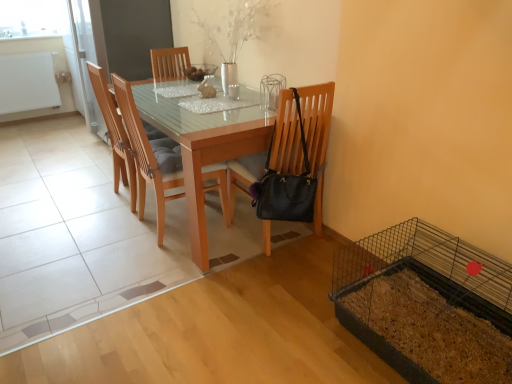
Measure the distance between black leather chair at center, acting as the 3th chair starting from the left, and camera.

The depth of black leather chair at center, acting as the 3th chair starting from the left, is 6.85 feet.

The image size is (512, 384). Identify the location of black leather chair at center, the first chair viewed from the right. (317, 136).

What is the approximate height of white matte radiator at upper left?

The height of white matte radiator at upper left is 24.44 inches.

The image size is (512, 384). In order to click on wooden chair at center, acting as the second chair starting from the right in this screenshot , I will do `click(146, 157)`.

Find the location of a particular element. light brown wood table at center is located at coordinates (204, 148).

At what (x,y) coordinates should I click in order to perform the action: click on radiator on the left of wooden chair at center, which is counted as the 3th chair, starting from the right. Please return your answer as a coordinate pair (x, y). Looking at the image, I should click on (27, 82).

From the image's perspective, is wooden chair at center, which is counted as the 3th chair, starting from the right, on white matte radiator at upper left?

No, from the image's perspective, wooden chair at center, which is counted as the 3th chair, starting from the right, is not above white matte radiator at upper left.

How many degrees apart are the facing directions of wooden chair at center, which is counted as the 3th chair, starting from the right, and white matte radiator at upper left?

90 degrees.

Does wooden chair at center, marked as the 1th chair in a left-to-right arrangement, have a greater width compared to white matte radiator at upper left?

Yes, wooden chair at center, marked as the 1th chair in a left-to-right arrangement, is wider than white matte radiator at upper left.

From the image's perspective, does light brown wood table at center appear higher than black leather chair at center, the first chair viewed from the right?

Yes, from the image's perspective, light brown wood table at center is above black leather chair at center, the first chair viewed from the right.

Does point (267, 240) come closer to viewer compared to point (307, 104)?

No, (267, 240) is further to viewer.

Would you say light brown wood table at center is inside or outside black leather chair at center, acting as the 3th chair starting from the left?

The correct answer is: outside.

Considering the sizes of objects light brown wood table at center and black leather chair at center, acting as the 3th chair starting from the left, in the image provided, who is smaller, light brown wood table at center or black leather chair at center, acting as the 3th chair starting from the left,?

Smaller between the two is black leather chair at center, acting as the 3th chair starting from the left.

In the scene shown: Is black leather chair at center, the first chair viewed from the right, in contact with white matte radiator at upper left?

black leather chair at center, the first chair viewed from the right, and white matte radiator at upper left are clearly separated.

Considering the relative sizes of black leather chair at center, acting as the 3th chair starting from the left, and white matte radiator at upper left in the image provided, is black leather chair at center, acting as the 3th chair starting from the left, shorter than white matte radiator at upper left?

No, black leather chair at center, acting as the 3th chair starting from the left, is not shorter than white matte radiator at upper left.

Where is `radiator on the left side of black leather chair at center, the first chair viewed from the right`? This screenshot has height=384, width=512. radiator on the left side of black leather chair at center, the first chair viewed from the right is located at coordinates (27, 82).

Is the position of black leather chair at center, acting as the 3th chair starting from the left, more distant than that of wooden chair at center, marked as the 1th chair in a left-to-right arrangement?

No, black leather chair at center, acting as the 3th chair starting from the left, is closer to the viewer.

Is black leather chair at center, acting as the 3th chair starting from the left, facing towards wooden chair at center, marked as the 1th chair in a left-to-right arrangement?

No, black leather chair at center, acting as the 3th chair starting from the left, is not facing towards wooden chair at center, marked as the 1th chair in a left-to-right arrangement.

How different are the orientations of black leather chair at center, the first chair viewed from the right, and wooden chair at center, marked as the 1th chair in a left-to-right arrangement, in degrees?

The angular difference between black leather chair at center, the first chair viewed from the right, and wooden chair at center, marked as the 1th chair in a left-to-right arrangement, is 87.5 degrees.

Between black leather chair at center, acting as the 3th chair starting from the left, and wooden chair at center, which is counted as the 3th chair, starting from the right, which one appears on the right side from the viewer's perspective?

Positioned to the right is black leather chair at center, acting as the 3th chair starting from the left.

What are the coordinates of `radiator located above the black leather chair at center, the first chair viewed from the right (from the image's perspective)` in the screenshot? It's located at (27, 82).

Between white matte radiator at upper left and black leather chair at center, the first chair viewed from the right, which one appears on the left side from the viewer's perspective?

Positioned to the left is white matte radiator at upper left.

Is point (33, 91) more distant than point (315, 229)?

Yes, it is behind point (315, 229).

How much distance is there between wooden chair at center, which ranks as the second chair in left-to-right order, and light brown wood table at center?

The distance of wooden chair at center, which ranks as the second chair in left-to-right order, from light brown wood table at center is 30.53 centimeters.

From a real-world perspective, who is located lower, wooden chair at center, acting as the second chair starting from the right, or light brown wood table at center?

light brown wood table at center is physically lower.

Is wooden chair at center, acting as the second chair starting from the right, positioned with its back to light brown wood table at center?

Yes, wooden chair at center, acting as the second chair starting from the right,'s orientation is away from light brown wood table at center.

Which object is wider, wooden chair at center, which ranks as the second chair in left-to-right order, or light brown wood table at center?

Wider between the two is light brown wood table at center.

Does point (197, 236) appear closer or farther from the camera than point (158, 173)?

Point (197, 236) appears to be closer to the viewer than point (158, 173).

What are the coordinates of `the 1st chair positioned below the light brown wood table at center (from the image's perspective)` in the screenshot? It's located at (146, 157).

Considering the sizes of objects light brown wood table at center and wooden chair at center, which ranks as the second chair in left-to-right order, in the image provided, who is smaller, light brown wood table at center or wooden chair at center, which ranks as the second chair in left-to-right order,?

Smaller between the two is wooden chair at center, which ranks as the second chair in left-to-right order.

Is light brown wood table at center taller than wooden chair at center, acting as the second chair starting from the right?

No, light brown wood table at center is not taller than wooden chair at center, acting as the second chair starting from the right.

The image size is (512, 384). In order to click on radiator that is under the wooden chair at center, which is counted as the 3th chair, starting from the right (from a real-world perspective) in this screenshot , I will do `click(27, 82)`.

Where is `kitchen & dining room table located above the black leather chair at center, acting as the 3th chair starting from the left (from the image's perspective)`? This screenshot has width=512, height=384. kitchen & dining room table located above the black leather chair at center, acting as the 3th chair starting from the left (from the image's perspective) is located at coordinates (204, 148).

From the picture: Which object lies nearer to the anchor point light brown wood table at center, wooden chair at center, acting as the second chair starting from the right, or wooden chair at center, which is counted as the 3th chair, starting from the right?

The object closer to light brown wood table at center is wooden chair at center, acting as the second chair starting from the right.

Estimate the real-world distances between objects in this image. Which object is further from light brown wood table at center, black leather chair at center, acting as the 3th chair starting from the left, or wooden chair at center, acting as the second chair starting from the right?

The object further to light brown wood table at center is wooden chair at center, acting as the second chair starting from the right.

Considering their positions, is black leather chair at center, acting as the 3th chair starting from the left, positioned further to white matte radiator at upper left than wooden chair at center, which is counted as the 3th chair, starting from the right?

Among the two, black leather chair at center, acting as the 3th chair starting from the left, is located further to white matte radiator at upper left.

Based on their spatial positions, is light brown wood table at center or black leather chair at center, the first chair viewed from the right, closer to white matte radiator at upper left?

light brown wood table at center.

Looking at the image, which one is located further to black leather chair at center, the first chair viewed from the right, white matte radiator at upper left or wooden chair at center, which ranks as the second chair in left-to-right order?

The object further to black leather chair at center, the first chair viewed from the right, is white matte radiator at upper left.

Considering their positions, is light brown wood table at center positioned further to wooden chair at center, which is counted as the 3th chair, starting from the right, than white matte radiator at upper left?

The object further to wooden chair at center, which is counted as the 3th chair, starting from the right, is white matte radiator at upper left.

Which object lies further to the anchor point wooden chair at center, which is counted as the 3th chair, starting from the right, wooden chair at center, acting as the second chair starting from the right, or light brown wood table at center?

light brown wood table at center is positioned further to the anchor wooden chair at center, which is counted as the 3th chair, starting from the right.

Looking at the image, which one is located further to wooden chair at center, acting as the second chair starting from the right, white matte radiator at upper left or black leather chair at center, acting as the 3th chair starting from the left?

Based on the image, white matte radiator at upper left appears to be further to wooden chair at center, acting as the second chair starting from the right.

Locate an element on the screen. Image resolution: width=512 pixels, height=384 pixels. kitchen & dining room table between wooden chair at center, which is counted as the 3th chair, starting from the right, and black leather chair at center, the first chair viewed from the right is located at coordinates (204, 148).

Where is `chair situated between wooden chair at center, marked as the 1th chair in a left-to-right arrangement, and black leather chair at center, acting as the 3th chair starting from the left, from left to right`? chair situated between wooden chair at center, marked as the 1th chair in a left-to-right arrangement, and black leather chair at center, acting as the 3th chair starting from the left, from left to right is located at coordinates (146, 157).

Where is `chair located between wooden chair at center, which ranks as the second chair in left-to-right order, and white matte radiator at upper left in the depth direction`? The image size is (512, 384). chair located between wooden chair at center, which ranks as the second chair in left-to-right order, and white matte radiator at upper left in the depth direction is located at coordinates (115, 134).

The image size is (512, 384). Find the location of `kitchen & dining room table situated between wooden chair at center, acting as the second chair starting from the right, and black leather chair at center, acting as the 3th chair starting from the left, from left to right`. kitchen & dining room table situated between wooden chair at center, acting as the second chair starting from the right, and black leather chair at center, acting as the 3th chair starting from the left, from left to right is located at coordinates (204, 148).